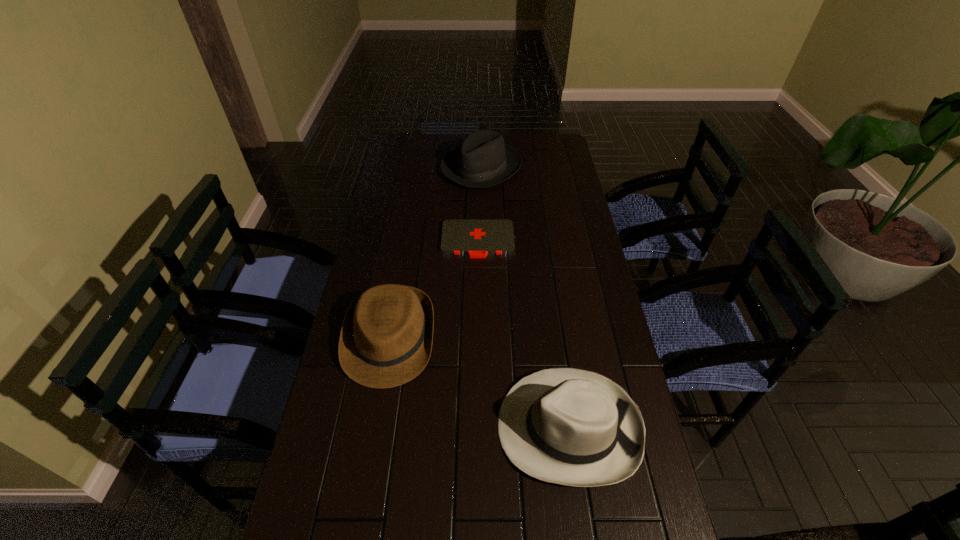
What are the coordinates of `the farthest object` in the screenshot? It's located at (483, 160).

At what (x,y) coordinates should I click in order to perform the action: click on the shortest fedora. Please return your answer as a coordinate pair (x, y). This screenshot has width=960, height=540. Looking at the image, I should click on (386, 338).

You are a GUI agent. You are given a task and a screenshot of the screen. Output one action in this format:
    pyautogui.click(x=<x>, y=<y>)
    Task: Click on the shortest object
    
    Given the screenshot: What is the action you would take?
    pyautogui.click(x=476, y=237)

The image size is (960, 540). I want to click on the first-aid kit, so click(476, 237).

Locate an element on the screen. Image resolution: width=960 pixels, height=540 pixels. vacant space positioned 0.120m on the right of the farthest object is located at coordinates (549, 168).

The width and height of the screenshot is (960, 540). In order to click on free point located 0.060m on the front-facing side of the shortest fedora in this screenshot , I will do [x=377, y=410].

In order to click on vacant space located on handle side the first-aid kit in this screenshot , I will do `click(477, 328)`.

Locate an element on the screen. object that is at the far edge is located at coordinates (483, 160).

The image size is (960, 540). I want to click on object that is at the left edge, so click(x=386, y=338).

At what (x,y) coordinates should I click in order to perform the action: click on object positioned at the right edge. Please return your answer as a coordinate pair (x, y). Looking at the image, I should click on (567, 426).